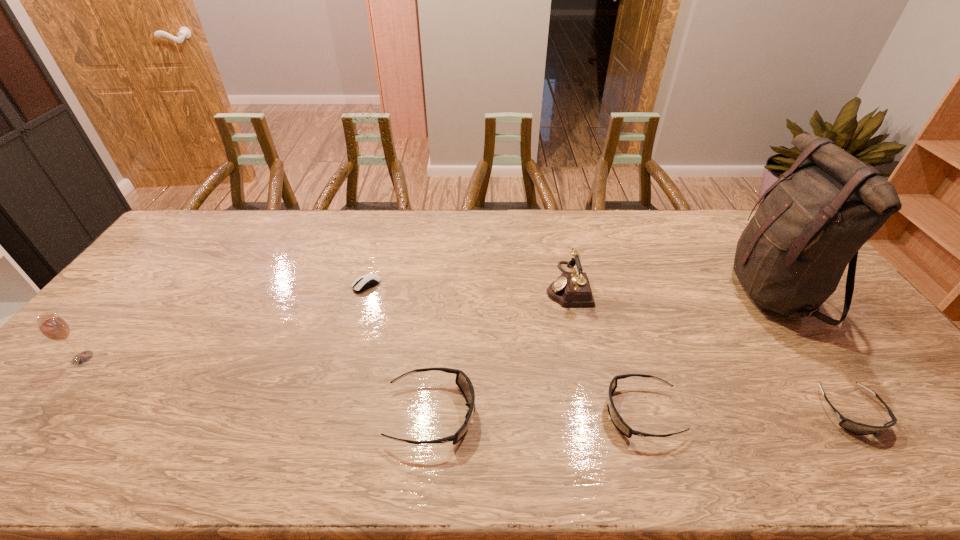
Identify the location of vacant space located 0.240m on the open flap of the tallest object. (653, 291).

Find the location of a particular element. free spot located on the open flap of the tallest object is located at coordinates (698, 291).

Where is `vacant space located on the open flap of the tallest object`? Image resolution: width=960 pixels, height=540 pixels. vacant space located on the open flap of the tallest object is located at coordinates (634, 291).

Find the location of `vacant space situated on the back of the leftmost object`. vacant space situated on the back of the leftmost object is located at coordinates (157, 268).

Where is `object present at the left edge`? object present at the left edge is located at coordinates (53, 327).

Identify the location of goggles that is at the right edge. Image resolution: width=960 pixels, height=540 pixels. (857, 428).

Identify the location of backpack located at the right edge. This screenshot has height=540, width=960. (790, 258).

The width and height of the screenshot is (960, 540). In order to click on object at the near right corner in this screenshot , I will do `click(857, 428)`.

Find the location of a particular element. vacant space at the far edge of the desktop is located at coordinates (476, 215).

Where is `free space at the near edge of the desktop`? The image size is (960, 540). free space at the near edge of the desktop is located at coordinates (737, 424).